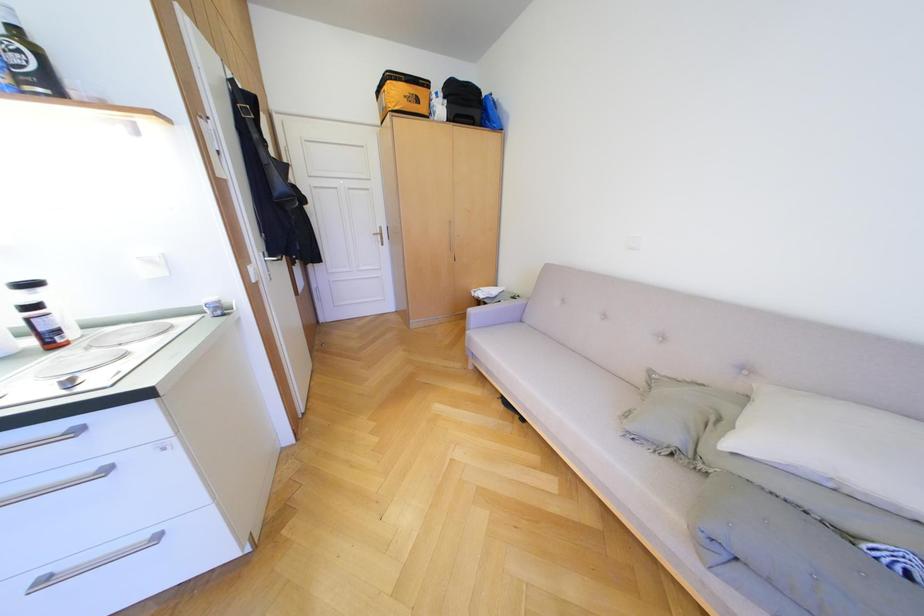
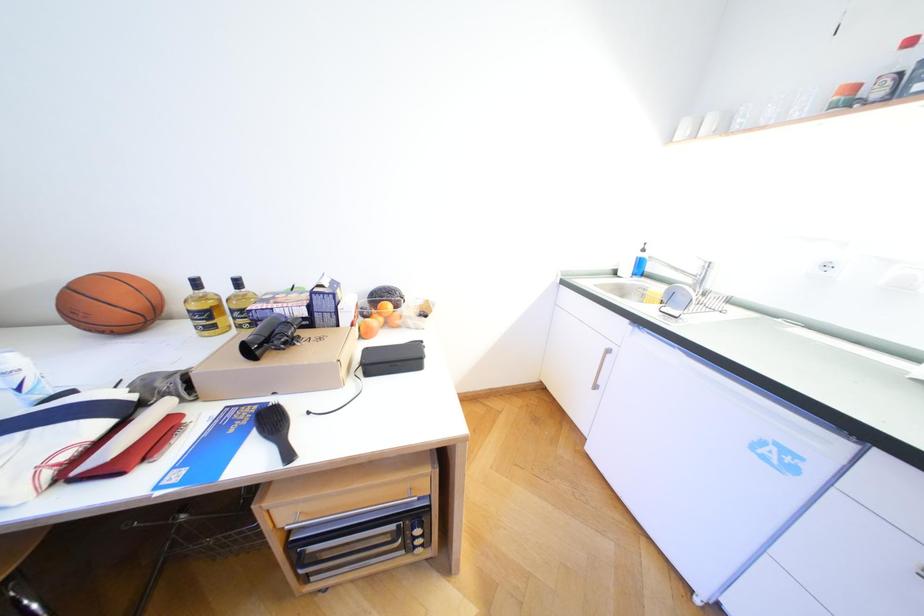
The first image is from the beginning of the video and the second image is from the end. How did the camera likely rotate when shooting the video?

The camera rotated toward left-down.